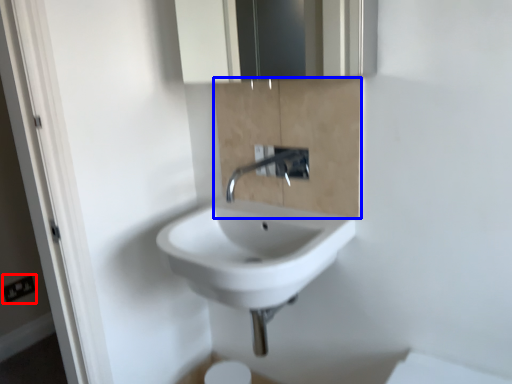
Question: Among these objects, which one is farthest to the camera, electric outlet (highlighted by a red box) or cabinetry (highlighted by a blue box)?

Choices:
 (A) electric outlet
 (B) cabinetry

Answer: (A)